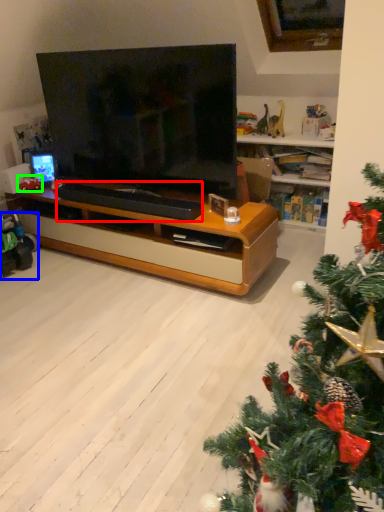
Question: Which is farther away from footrest (highlighted by a red box)? toy (highlighted by a blue box) or toy (highlighted by a green box)?

Choices:
 (A) toy
 (B) toy

Answer: (B)